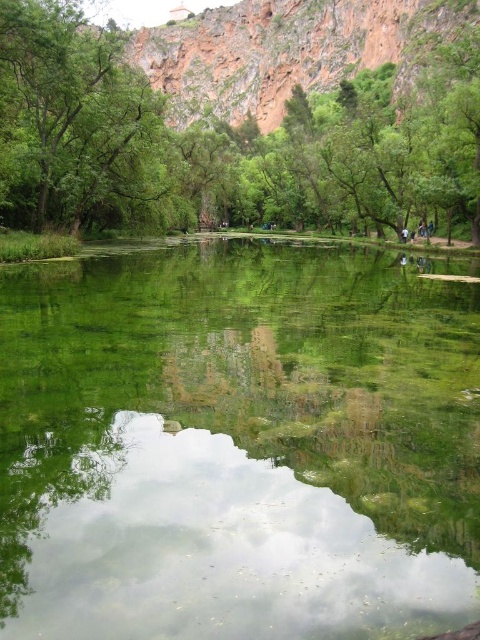
Does green reflective water at center appear on the left side of green leafy tree at center?

No, green reflective water at center is not to the left of green leafy tree at center.

Can you confirm if green reflective water at center is bigger than green leafy tree at center?

No, green reflective water at center is not bigger than green leafy tree at center.

Describe the element at coordinates (238, 444) in the screenshot. I see `green reflective water at center` at that location.

Find the location of a particular element. The width and height of the screenshot is (480, 640). green reflective water at center is located at coordinates (238, 444).

Is green leafy tree at center positioned before green leafy tree at upper left?

No, green leafy tree at center is further to the viewer.

Does green leafy tree at center have a greater width compared to green leafy tree at upper left?

Yes, green leafy tree at center is wider than green leafy tree at upper left.

Is point (72, 180) positioned behind point (0, 188)?

Yes, point (72, 180) is farther from viewer.

Locate an element on the screen. Image resolution: width=480 pixels, height=640 pixels. green leafy tree at center is located at coordinates (240, 116).

Does green reflective water at center have a greater height compared to green leafy tree at upper left?

No, green reflective water at center is not taller than green leafy tree at upper left.

From the picture: Does green reflective water at center have a lesser height compared to green leafy tree at upper left?

Yes, green reflective water at center is shorter than green leafy tree at upper left.

This screenshot has height=640, width=480. What do you see at coordinates (238, 444) in the screenshot?
I see `green reflective water at center` at bounding box center [238, 444].

Find the location of a particular element. Image resolution: width=480 pixels, height=640 pixels. green reflective water at center is located at coordinates (238, 444).